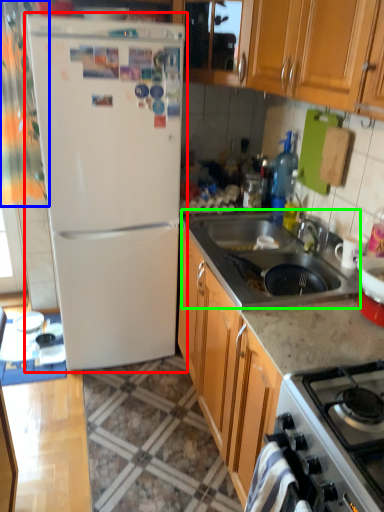
Question: Which object is the farthest from refrigerator (highlighted by a red box)? Choose among these: curtain (highlighted by a blue box) or sink (highlighted by a green box).

Choices:
 (A) curtain
 (B) sink

Answer: (B)